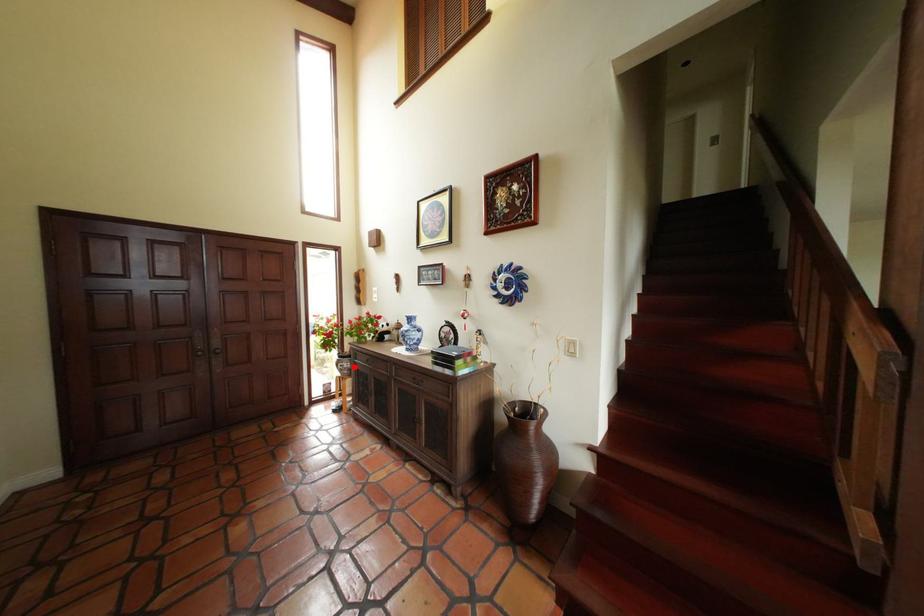
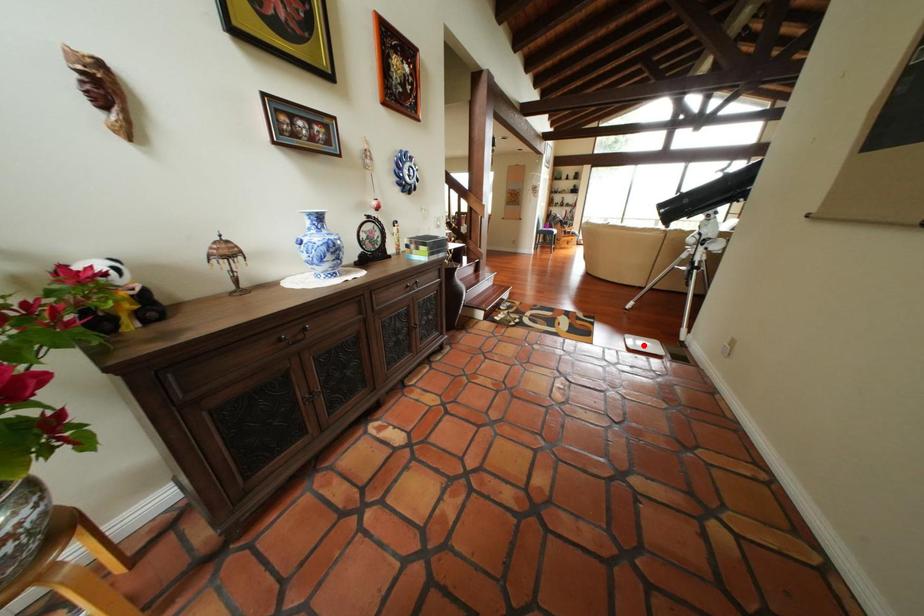
I am providing you with two images of the same scene from different viewpoints. A red point is marked on the first image and another point is marked on the second image. Does the point marked in image1 correspond to the same location as the one in image2?

No